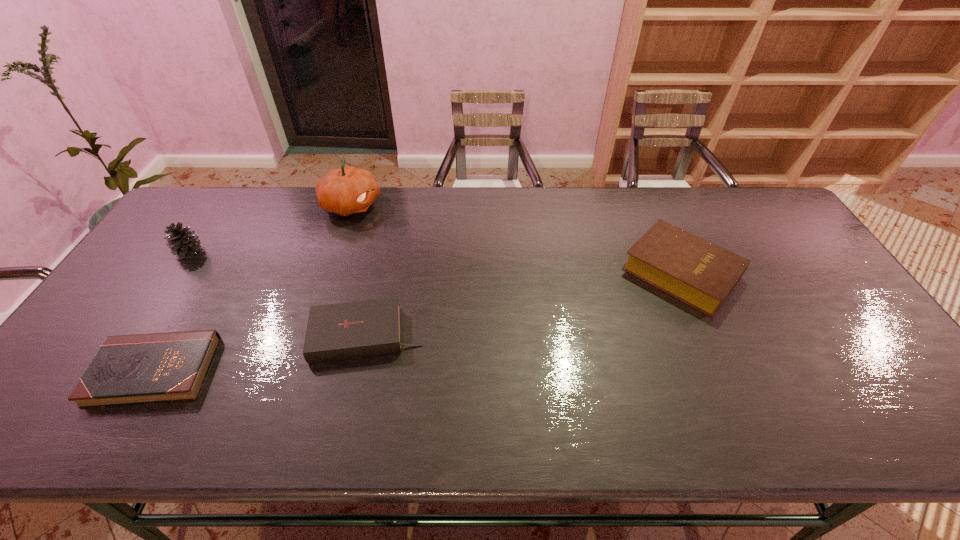
I want to click on free space located 0.120m on the left of the tallest Bible, so click(582, 272).

The height and width of the screenshot is (540, 960). I want to click on vacant region located on the back of the second Bible from right to left, so click(x=376, y=292).

Where is `blank space located 0.390m on the right of the shortest object`? blank space located 0.390m on the right of the shortest object is located at coordinates (375, 371).

Find the location of `object that is at the far edge`. object that is at the far edge is located at coordinates (349, 190).

I want to click on object situated at the near edge, so click(x=158, y=367).

At what (x,y) coordinates should I click in order to perform the action: click on pinecone that is at the left edge. Please return your answer as a coordinate pair (x, y). Looking at the image, I should click on (182, 241).

The height and width of the screenshot is (540, 960). I want to click on Bible that is at the left edge, so tap(158, 367).

Where is `object at the near left corner`? The width and height of the screenshot is (960, 540). object at the near left corner is located at coordinates (158, 367).

Image resolution: width=960 pixels, height=540 pixels. In the image, there is a desktop. What are the coordinates of `vacant space at the far edge` in the screenshot? It's located at (516, 212).

Locate an element on the screen. The height and width of the screenshot is (540, 960). vacant space at the near edge of the desktop is located at coordinates (665, 443).